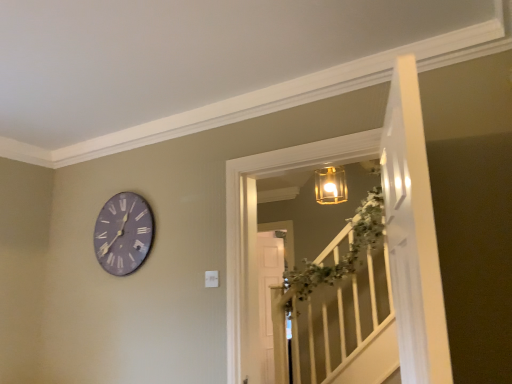
Locate an element on the screen. This screenshot has height=384, width=512. white glossy door at upper right is located at coordinates (412, 234).

Which object is positioned more to the left, purple matte clock at upper left or translucent glass lantern at upper center?

purple matte clock at upper left.

Is translucent glass lantern at upper center surrounded by purple matte clock at upper left?

No, translucent glass lantern at upper center is located outside of purple matte clock at upper left.

How much distance is there between purple matte clock at upper left and translucent glass lantern at upper center?

They are 5.79 feet apart.

Which object is more forward, purple matte clock at upper left or translucent glass lantern at upper center?

Positioned in front is translucent glass lantern at upper center.

From a real-world perspective, is translucent glass lantern at upper center over purple matte clock at upper left?

No, from a real-world perspective, translucent glass lantern at upper center is not over purple matte clock at upper left

Considering the relative positions of translucent glass lantern at upper center and purple matte clock at upper left in the image provided, is translucent glass lantern at upper center to the left of purple matte clock at upper left from the viewer's perspective?

Incorrect, translucent glass lantern at upper center is not on the left side of purple matte clock at upper left.

Which object is further away from the camera taking this photo, translucent glass lantern at upper center or purple matte clock at upper left?

Positioned behind is purple matte clock at upper left.

From a real-world perspective, is purple matte clock at upper left located higher than white glossy door at upper right?

Correct, in the physical world, purple matte clock at upper left is higher than white glossy door at upper right.

Does purple matte clock at upper left have a larger size compared to white glossy door at upper right?

No, purple matte clock at upper left is not bigger than white glossy door at upper right.

What's the angular difference between purple matte clock at upper left and white glossy door at upper right's facing directions?

There is a 74.1-degree angle between the facing directions of purple matte clock at upper left and white glossy door at upper right.

Considering the sizes of purple matte clock at upper left and white glossy door at upper right in the image, is purple matte clock at upper left taller or shorter than white glossy door at upper right?

purple matte clock at upper left is shorter than white glossy door at upper right.

Which of these two, white glossy door at upper right or translucent glass lantern at upper center, is wider?

With larger width is translucent glass lantern at upper center.

Which object is positioned more to the left, white glossy door at upper right or translucent glass lantern at upper center?

translucent glass lantern at upper center is more to the left.

Which object is closer to the camera taking this photo, white glossy door at upper right or translucent glass lantern at upper center?

white glossy door at upper right is in front.

Does white glossy door at upper right have a lesser height compared to translucent glass lantern at upper center?

No, white glossy door at upper right is not shorter than translucent glass lantern at upper center.

Looking at this image, is the depth of translucent glass lantern at upper center less than that of white glossy door at upper right?

No, translucent glass lantern at upper center is further to the viewer.

Locate an element on the screen. Image resolution: width=512 pixels, height=384 pixels. door above the translucent glass lantern at upper center (from a real-world perspective) is located at coordinates (412, 234).

In the image, is translucent glass lantern at upper center on the left side or the right side of white glossy door at upper right?

translucent glass lantern at upper center is positioned on white glossy door at upper right's left side.

Is translucent glass lantern at upper center far from white glossy door at upper right?

translucent glass lantern at upper center is positioned a significant distance from white glossy door at upper right.

Is white glossy door at upper right facing towards purple matte clock at upper left?

Yes, white glossy door at upper right is oriented towards purple matte clock at upper left.

Based on their sizes in the image, would you say white glossy door at upper right is bigger or smaller than purple matte clock at upper left?

Clearly, white glossy door at upper right is larger in size than purple matte clock at upper left.

Can we say white glossy door at upper right lies outside purple matte clock at upper left?

white glossy door at upper right lies outside purple matte clock at upper left's area.

From the image's perspective, would you say white glossy door at upper right is shown under purple matte clock at upper left?

No.

I want to click on window in front of the purple matte clock at upper left, so click(348, 328).

Identify the location of window on the right of purple matte clock at upper left. The image size is (512, 384). (348, 328).

Estimate the real-world distances between objects in this image. Which object is further from translucent glass lantern at upper center, white glossy door at upper right or purple matte clock at upper left?

The object further to translucent glass lantern at upper center is white glossy door at upper right.

Considering their positions, is white glossy door at upper right positioned further to purple matte clock at upper left than translucent glass lantern at upper center?

Based on the image, translucent glass lantern at upper center appears to be further to purple matte clock at upper left.

Based on their spatial positions, is translucent glass lantern at upper center or white glossy door at upper right closer to purple matte clock at upper left?

The object closer to purple matte clock at upper left is white glossy door at upper right.

Which object lies nearer to the anchor point white glossy door at upper right, translucent glass lantern at upper center or purple matte clock at upper left?

purple matte clock at upper left is closer to white glossy door at upper right.

Considering their positions, is purple matte clock at upper left positioned closer to white glossy door at upper right than translucent glass lantern at upper center?

purple matte clock at upper left is closer to white glossy door at upper right.

From the image, which object appears to be farther from translucent glass lantern at upper center, purple matte clock at upper left or white glossy door at upper right?

The object further to translucent glass lantern at upper center is white glossy door at upper right.

Image resolution: width=512 pixels, height=384 pixels. What are the coordinates of `window positioned between white glossy door at upper right and purple matte clock at upper left from near to far` in the screenshot? It's located at (348, 328).